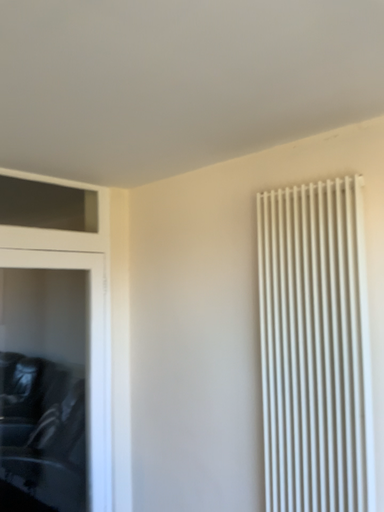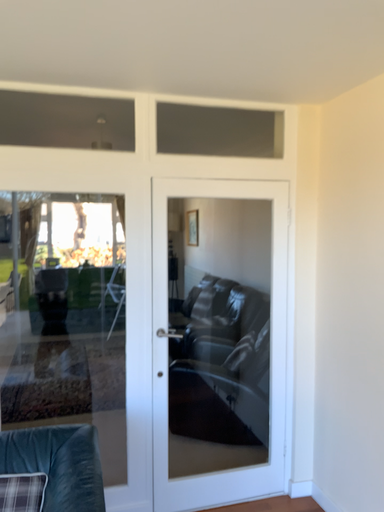
Question: Which way did the camera rotate in the video?

Choices:
 (A) rotated right
 (B) rotated left

Answer: (B)